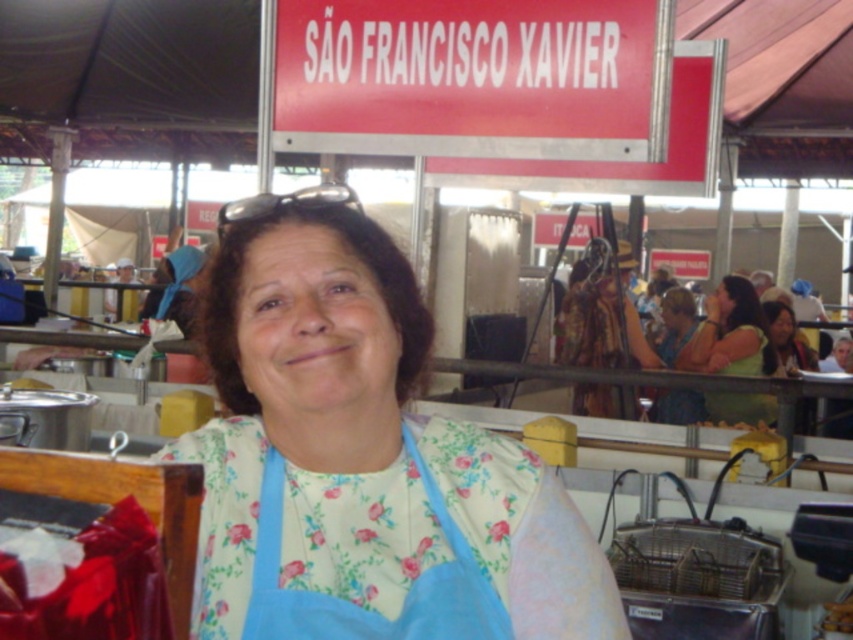
Question: Can you confirm if blue floral fabric apron at center is smaller than green fabric shirt at right?

Choices:
 (A) no
 (B) yes

Answer: (B)

Question: Does floral fabric apron at center have a smaller size compared to red plastic sign at upper center?

Choices:
 (A) yes
 (B) no

Answer: (A)

Question: From the image, what is the correct spatial relationship of green fabric shirt at right in relation to blue fabric at right?

Choices:
 (A) left
 (B) right

Answer: (B)

Question: Which point is farther to the camera?

Choices:
 (A) (740, 417)
 (B) (219, 218)

Answer: (A)

Question: Which point is closer to the camera?

Choices:
 (A) (527, 544)
 (B) (735, 305)

Answer: (A)

Question: Which point is closer to the camera taking this photo?

Choices:
 (A) (421, 452)
 (B) (381, 260)
 (C) (763, 324)

Answer: (B)